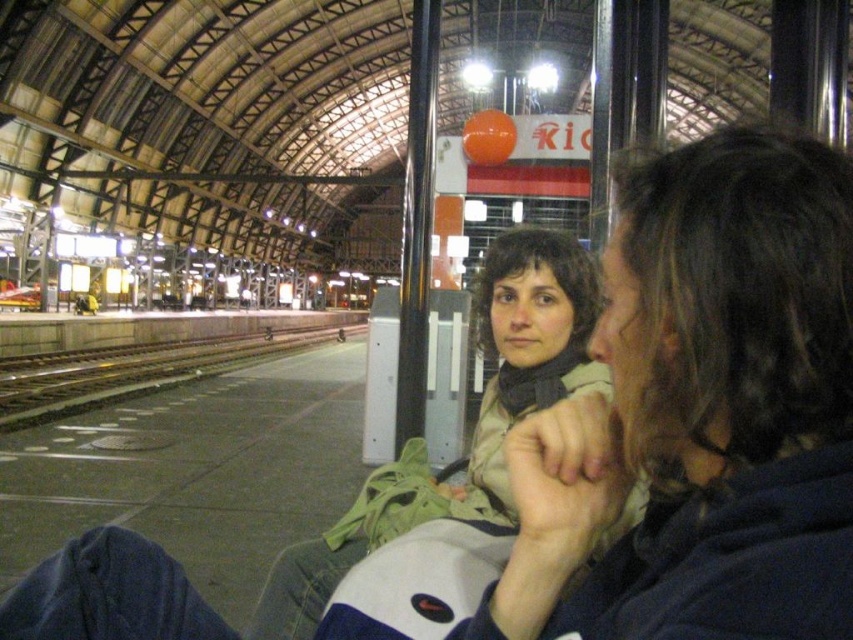
Question: Does matte beige scarf at center have a smaller size compared to black metal train track at left?

Choices:
 (A) yes
 (B) no

Answer: (A)

Question: Is matte beige scarf at center bigger than black metal train track at left?

Choices:
 (A) yes
 (B) no

Answer: (B)

Question: Observing the image, what is the correct spatial positioning of green fabric jacket at center in reference to black metal train track at left?

Choices:
 (A) below
 (B) above

Answer: (B)

Question: Estimate the real-world distances between objects in this image. Which object is closer to the green fabric jacket at center?

Choices:
 (A) black metal train track at left
 (B) matte beige scarf at center

Answer: (B)

Question: Considering the real-world distances, which object is closest to the green fabric jacket at center?

Choices:
 (A) matte beige scarf at center
 (B) black metal train track at left

Answer: (A)

Question: Which point is closer to the camera taking this photo?

Choices:
 (A) (772, 138)
 (B) (0, 388)

Answer: (A)